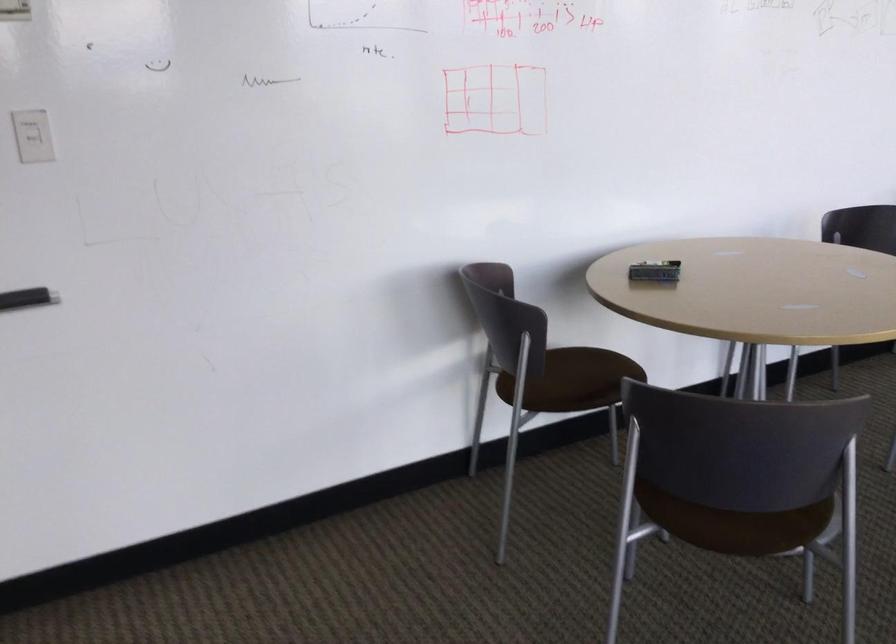
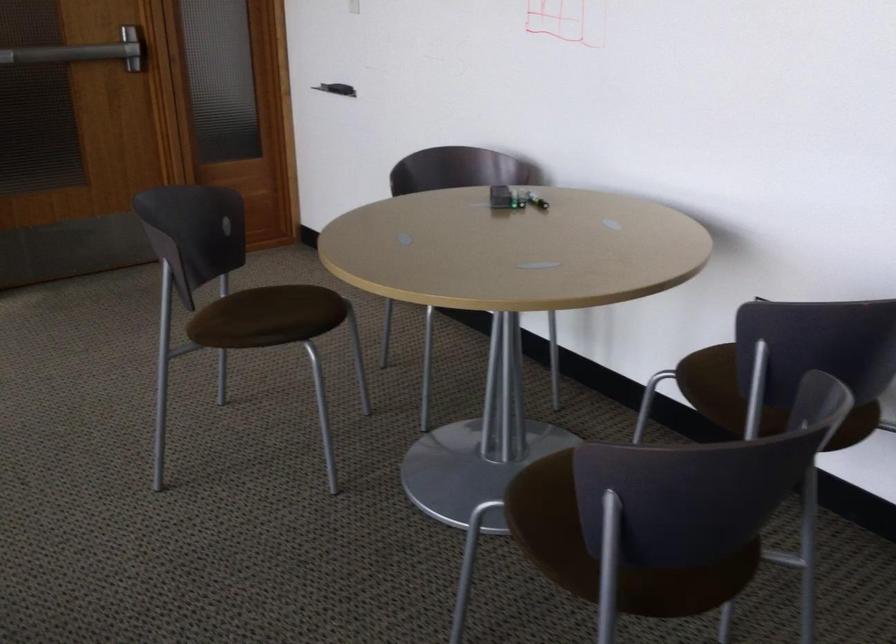
Locate, in the second image, the point that corresponds to pixel 662 272 in the first image.

(498, 198)